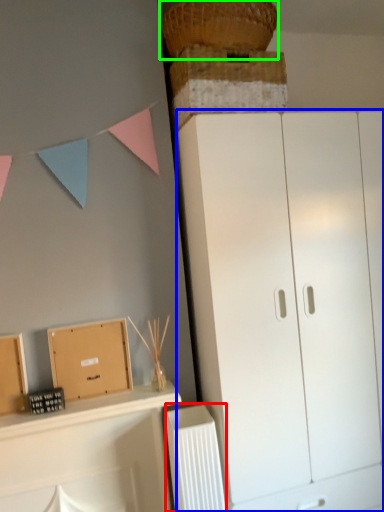
Question: Which is nearer to the radiator (highlighted by a red box)? cupboard (highlighted by a blue box) or basket (highlighted by a green box).

Choices:
 (A) cupboard
 (B) basket

Answer: (A)